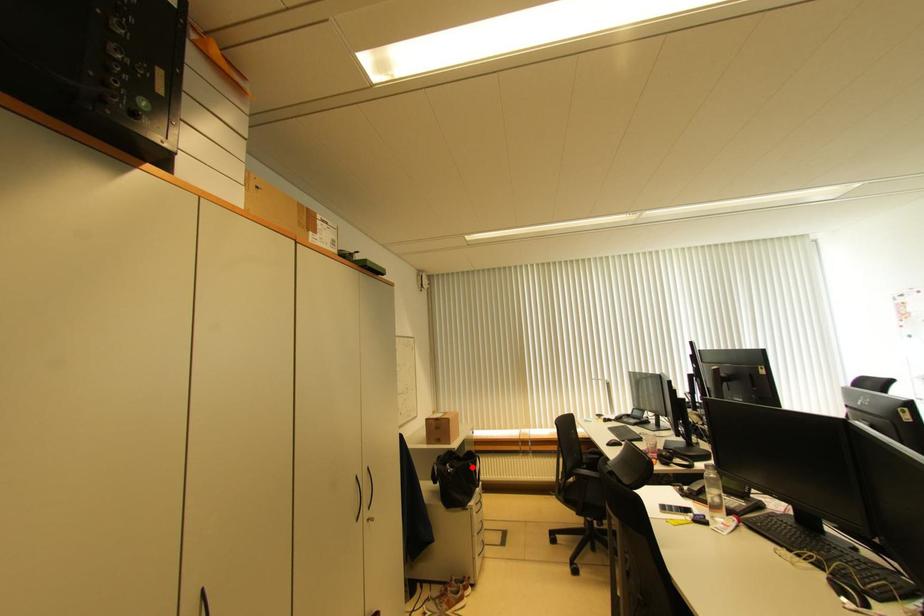
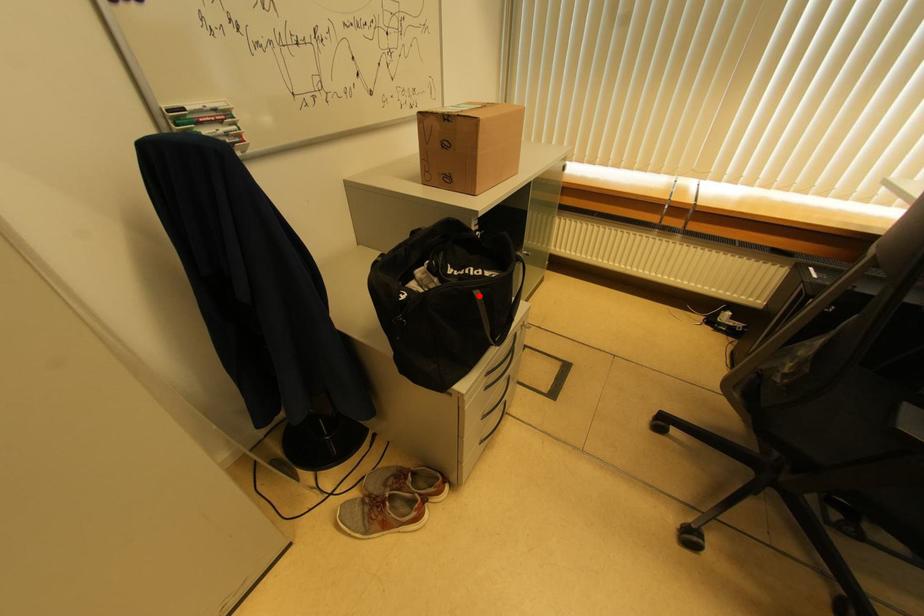
I am providing you with two images of the same scene from different viewpoints. A red point is marked on the first image and another point is marked on the second image. Does the point marked in image1 correspond to the same location as the one in image2?

Yes